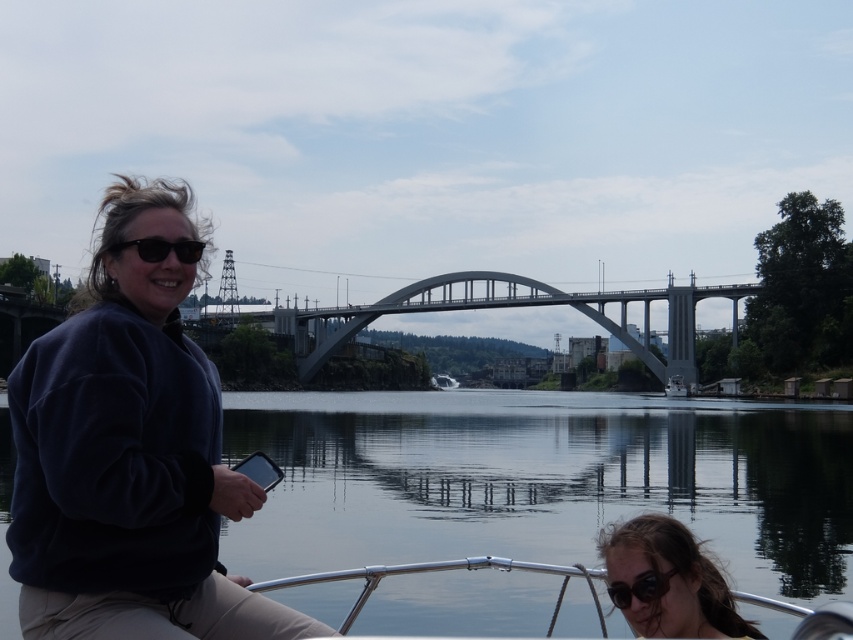
Is dark brown hair at lower right shorter than black matte sunglasses at upper left?

No.

How distant is dark brown hair at lower right from black matte sunglasses at upper left?

dark brown hair at lower right and black matte sunglasses at upper left are 151.36 feet apart from each other.

Is point (662, 625) farther from camera compared to point (157, 237)?

Yes, it is behind point (157, 237).

Where is `dark brown hair at lower right`? dark brown hair at lower right is located at coordinates (666, 580).

Is glossy water at center thinner than black matte sunglasses at lower center?

No, glossy water at center is not thinner than black matte sunglasses at lower center.

Which is above, glossy water at center or black matte sunglasses at lower center?

glossy water at center

Between point (762, 628) and point (618, 589), which one is positioned in front?

Positioned in front is point (618, 589).

You are a GUI agent. You are given a task and a screenshot of the screen. Output one action in this format:
    pyautogui.click(x=<x>, y=<y>)
    Task: Click on the glossy water at center
    
    Given the screenshot: What is the action you would take?
    pyautogui.click(x=543, y=481)

Between glossy water at center and dark blue fleece at left, which one has more height?

Standing taller between the two is dark blue fleece at left.

You are a GUI agent. You are given a task and a screenshot of the screen. Output one action in this format:
    pyautogui.click(x=<x>, y=<y>)
    Task: Click on the glossy water at center
    Image resolution: width=853 pixels, height=640 pixels.
    Given the screenshot: What is the action you would take?
    pyautogui.click(x=543, y=481)

I want to click on glossy water at center, so click(543, 481).

This screenshot has height=640, width=853. In order to click on glossy water at center in this screenshot , I will do `click(543, 481)`.